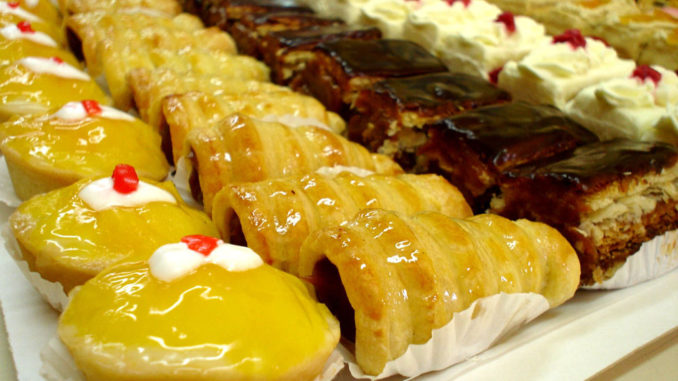
I want to click on white doily on which first cornet-shaped cake is placed, so click(x=481, y=334).